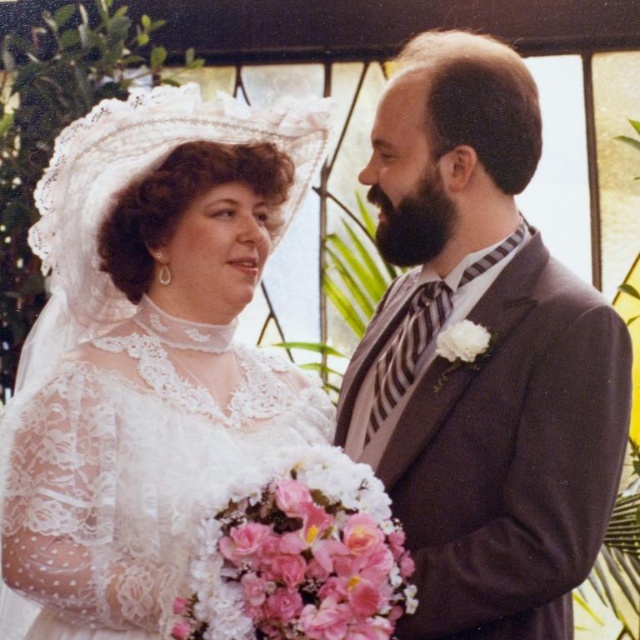
Question: Considering the real-world distances, which object is farthest from the white matte flower at upper right?

Choices:
 (A) white lace dress at left
 (B) matte gray suit at center

Answer: (A)

Question: Which object is farther from the camera taking this photo?

Choices:
 (A) white lace dress at left
 (B) white matte flower at upper right
 (C) matte gray suit at center
 (D) pink floral bouquet at center

Answer: (B)

Question: In this image, where is matte gray suit at center located relative to pink floral bouquet at center?

Choices:
 (A) below
 (B) above

Answer: (B)

Question: Which object appears closest to the camera in this image?

Choices:
 (A) matte gray suit at center
 (B) white matte flower at upper right
 (C) pink floral bouquet at center
 (D) white lace dress at left

Answer: (C)

Question: Is white lace dress at left bigger than matte gray suit at center?

Choices:
 (A) no
 (B) yes

Answer: (B)

Question: Where is matte gray suit at center located in relation to pink floral bouquet at center in the image?

Choices:
 (A) right
 (B) left

Answer: (A)